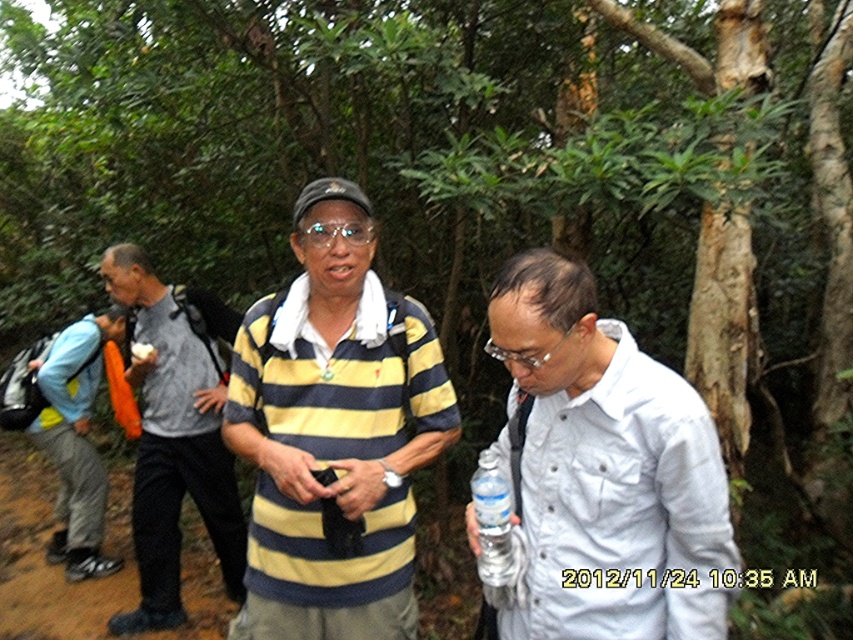
Question: Which point is closer to the camera taking this photo?

Choices:
 (A) (483, 544)
 (B) (578, 467)

Answer: (B)

Question: Estimate the real-world distances between objects in this image. Which object is closer to the white matte shirt at center?

Choices:
 (A) clear plastic bottle at center
 (B) yellow striped shirt at center

Answer: (A)

Question: Is white matte shirt at center to the right of gray dotted pants at left from the viewer's perspective?

Choices:
 (A) yes
 (B) no

Answer: (A)

Question: Does yellow striped shirt at center have a smaller size compared to white matte shirt at center?

Choices:
 (A) yes
 (B) no

Answer: (A)

Question: Which point is farther to the camera?

Choices:
 (A) gray dotted pants at left
 (B) clear plastic bottle at center
 (C) yellow striped shirt at center

Answer: (A)

Question: Does yellow striped shirt at center have a lesser width compared to white matte shirt at center?

Choices:
 (A) no
 (B) yes

Answer: (A)